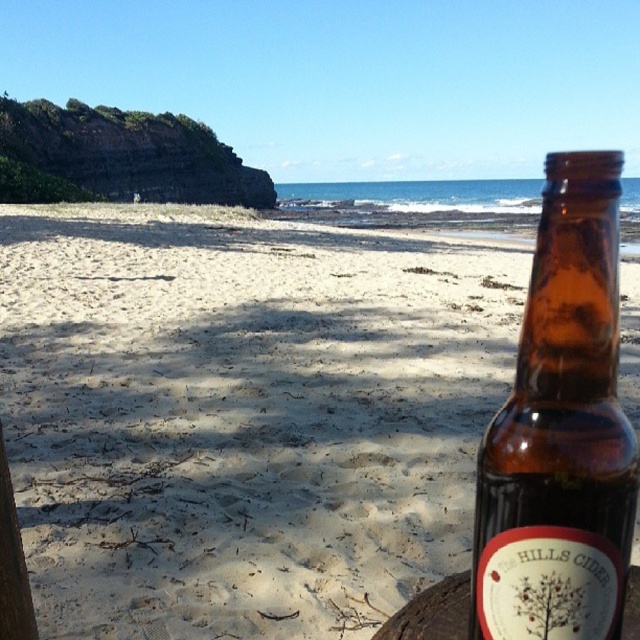
You are a photographer setting up a shot of the sandytexture at lower left and the brown glass bottle at right. Which object will appear larger in the photo?

The sandytexture at lower left is taller than the brown glass bottle at right, so it will appear larger in the photo.

You are standing at the point marked by the coordinates point (243, 416) in the image. What type of texture would you feel under your feet?

The point (243, 416) indicates sandytexture at lower left, so you would feel sand under your feet.

You are standing on the beach and see the sandytexture at lower left and the brown glass bottle at right. Which object is positioned higher in the image?

The sandytexture at lower left is above the brown glass bottle at right, so it is positioned higher in the image.